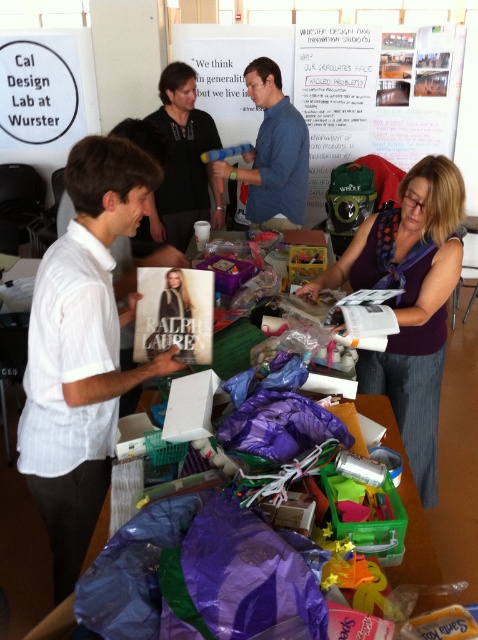
You are a photographer standing at the back of the workshop. You want to take a photo that includes both the white striped shirt at left and the purple fabric at center. The camera you have can only focus on objects within a 3.5 feet range. Will both objects be in focus?

The distance between the white striped shirt at left and the purple fabric at center is 3.37 feet, which is within the 3.5 feet focus range of the camera. Therefore, both objects will be in focus.